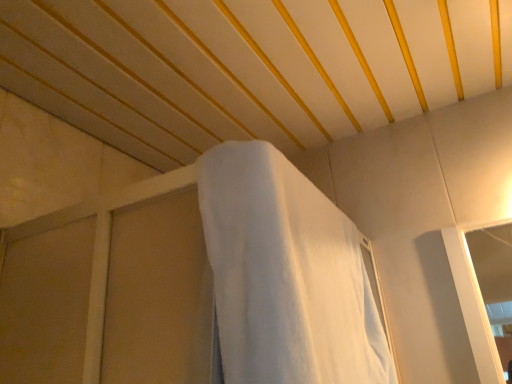
Identify the location of white fabric curtain at upper center. (285, 276).

What do you see at coordinates (285, 276) in the screenshot? Image resolution: width=512 pixels, height=384 pixels. I see `white fabric curtain at upper center` at bounding box center [285, 276].

Where is `white fabric curtain at upper center`? white fabric curtain at upper center is located at coordinates (285, 276).